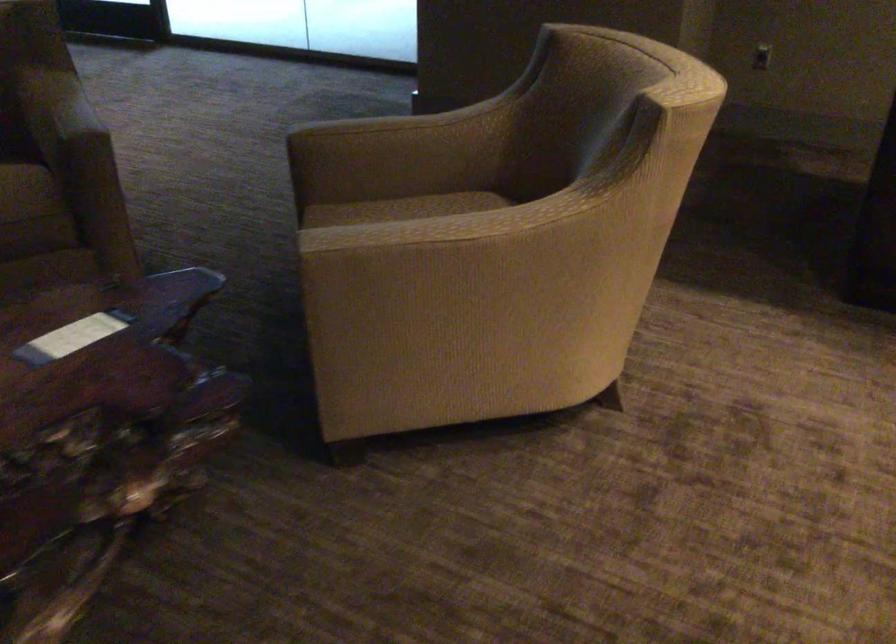
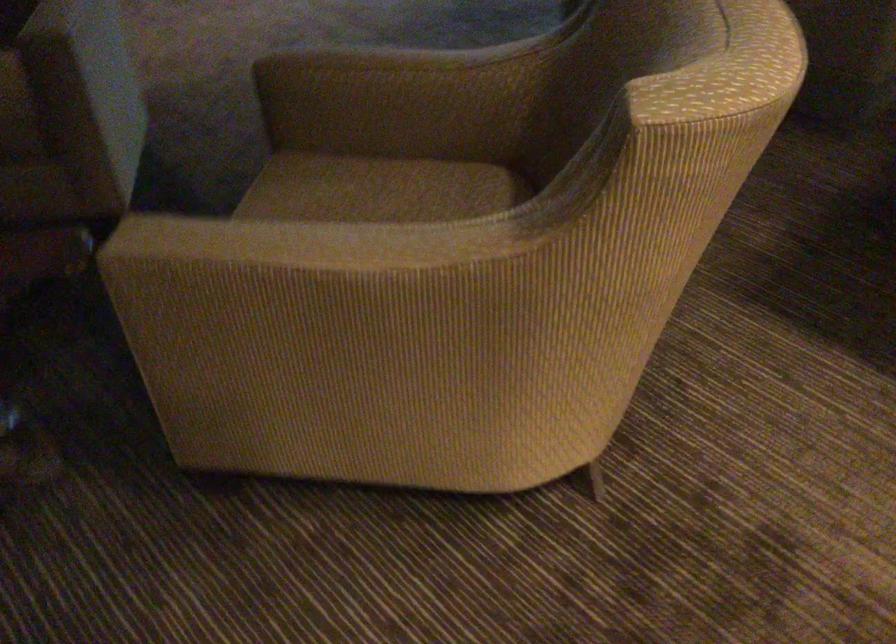
Find the pixel in the second image that matches the point at 389,124 in the first image.

(380, 61)